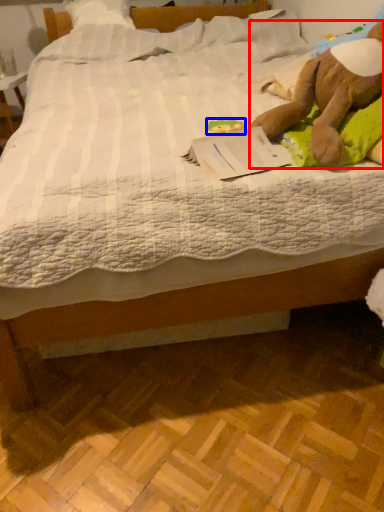
Question: Which of the following is the closest to the observer, animal (highlighted by a red box) or toy (highlighted by a blue box)?

Choices:
 (A) animal
 (B) toy

Answer: (A)